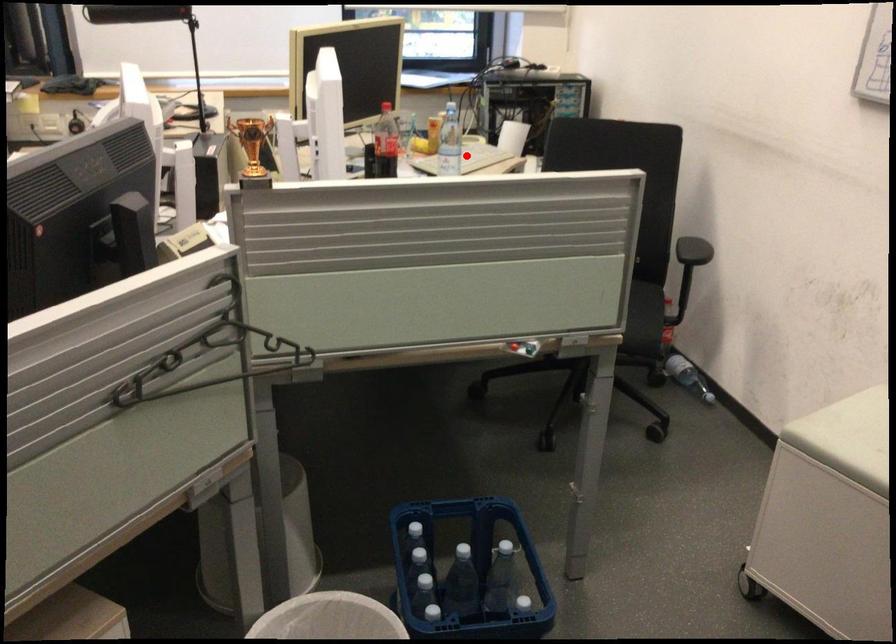
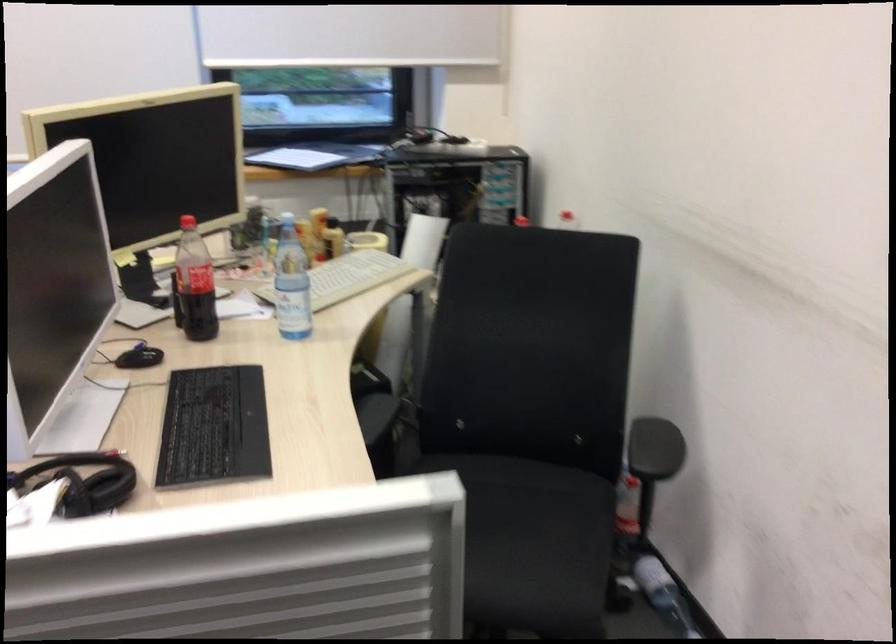
The point at the highlighted location is marked in the first image. Where is the corresponding point in the second image?

(347, 277)